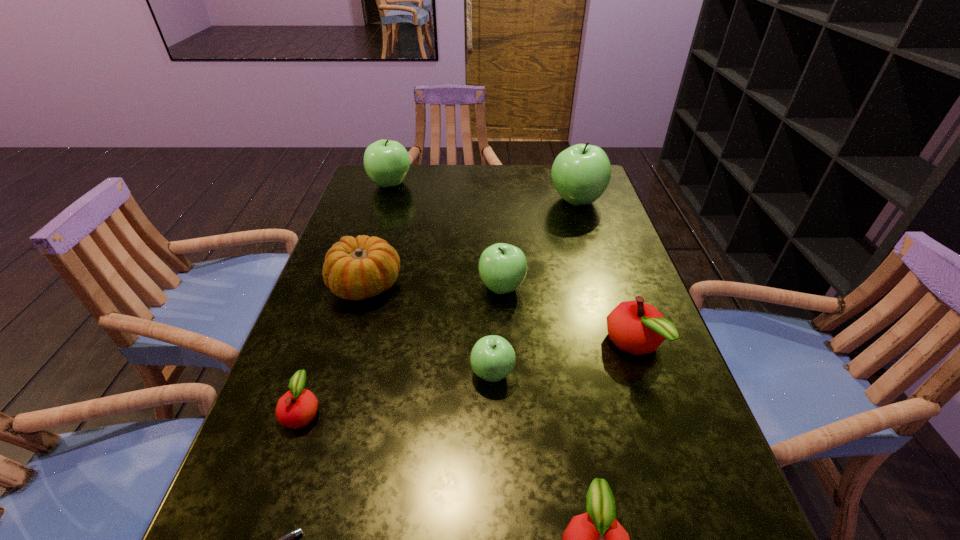
This screenshot has height=540, width=960. Find the location of `the rightmost green apple`. the rightmost green apple is located at coordinates (581, 173).

You are a GUI agent. You are given a task and a screenshot of the screen. Output one action in this format:
    pyautogui.click(x=<x>, y=<y>)
    Task: Click on the biggest green apple
    The width and height of the screenshot is (960, 540).
    Given the screenshot: What is the action you would take?
    pyautogui.click(x=581, y=173)

What are the coordinates of `the second tallest apple` in the screenshot? It's located at (386, 162).

Locate an element on the screen. This screenshot has width=960, height=540. the second tallest object is located at coordinates (386, 162).

Where is `the third biggest green apple`? The image size is (960, 540). the third biggest green apple is located at coordinates (502, 267).

Locate an element on the screen. the third farthest green apple is located at coordinates (502, 267).

The width and height of the screenshot is (960, 540). Find the location of `gourd`. gourd is located at coordinates (357, 268).

Identify the location of the biggest red apple. This screenshot has width=960, height=540. tap(636, 327).

Where is `the rightmost red apple`? The image size is (960, 540). the rightmost red apple is located at coordinates (636, 327).

I want to click on the nearest green apple, so click(x=492, y=358).